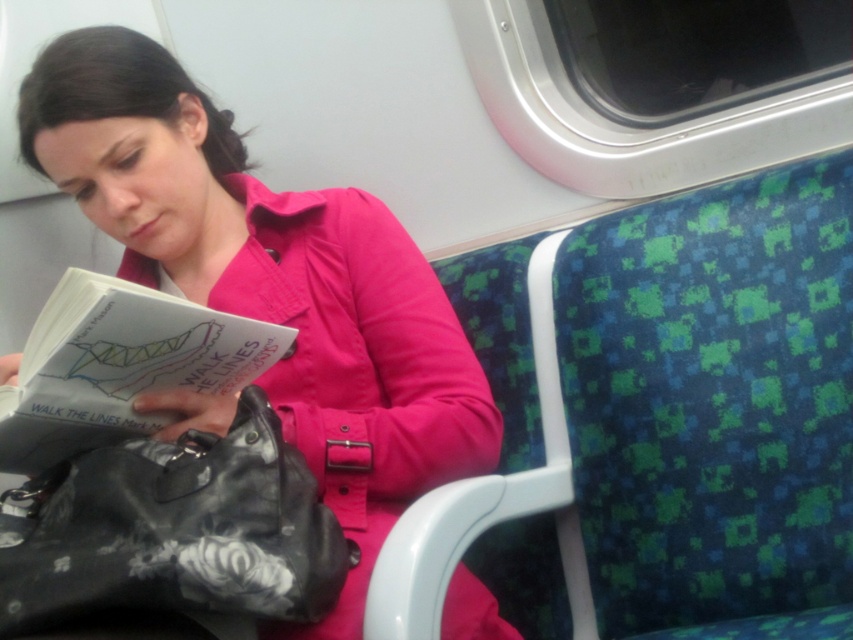
You are a passenger on a train and want to find the pink fabric jacket at center. Based on the coordinates given, where should you look in the train car?

The pink fabric jacket at center is located at the coordinates point (271, 282) in the train car.

You are a passenger on a train and need to store your belongings. You have a pink fabric jacket at center and a black leather bag at lower left. Which item would require more space to store?

The pink fabric jacket at center is larger in size than the black leather bag at lower left, so it would require more storage space.

You are a passenger on a train and you want to place your black leather bag at lower left on the seat next to your pink fabric jacket at center. Considering their sizes, will the bag fit without overlapping the jacket?

The pink fabric jacket at center has a greater height compared to the black leather bag at lower left. Since the jacket is taller, placing the bag next to it on the seat should be possible without overlapping, as the bag is shorter and can fit alongside.